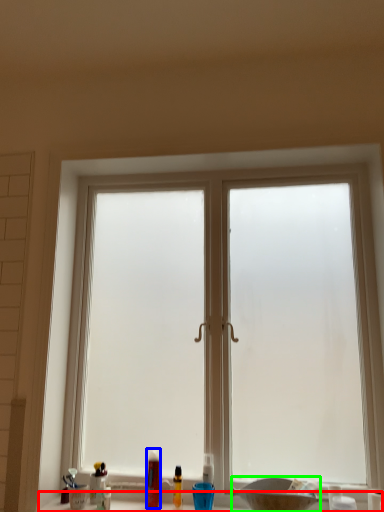
Question: Which object is positioned farthest from counter top (highlighted by a red box)? Select from toiletry (highlighted by a blue box) and basin (highlighted by a green box).

Choices:
 (A) toiletry
 (B) basin

Answer: (B)